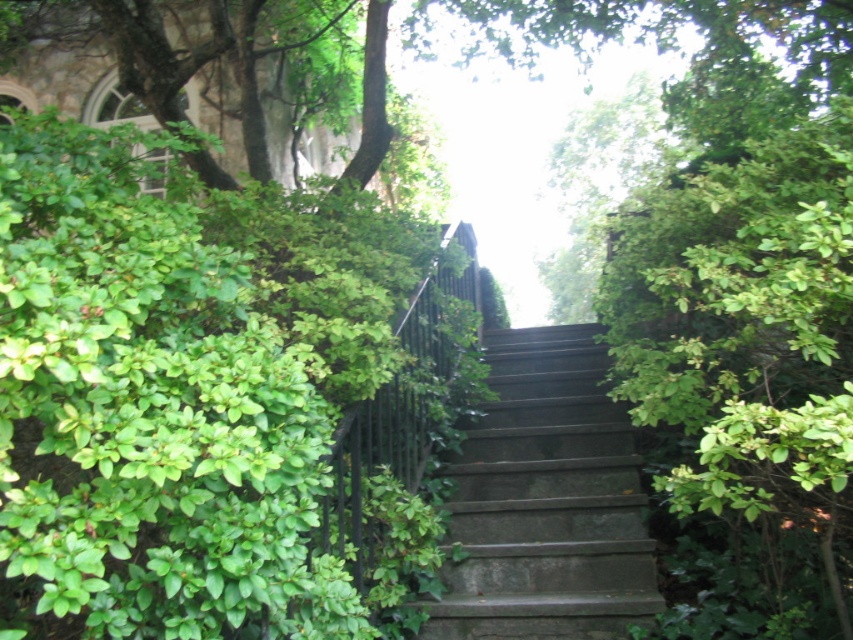
Question: Can you confirm if green leafy bush at left is positioned to the right of green leafy tree at upper center?

Choices:
 (A) no
 (B) yes

Answer: (A)

Question: Considering the real-world distances, which object is closest to the green leafy bush at left?

Choices:
 (A) dark gray stone stairs at center
 (B) green leafy tree at upper center

Answer: (A)

Question: Is green leafy bush at left positioned behind dark gray stone stairs at center?

Choices:
 (A) yes
 (B) no

Answer: (B)

Question: Does green leafy bush at left appear under dark gray stone stairs at center?

Choices:
 (A) no
 (B) yes

Answer: (A)

Question: Among these objects, which one is nearest to the camera?

Choices:
 (A) green leafy tree at upper center
 (B) green leafy bush at left

Answer: (B)

Question: Considering the real-world distances, which object is farthest from the green leafy bush at left?

Choices:
 (A) dark gray stone stairs at center
 (B) green leafy tree at upper center

Answer: (B)